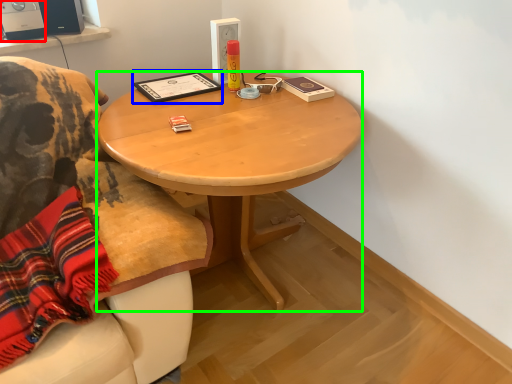
Question: Which object is the farthest from loudspeaker (highlighted by a red box)? Choose among these: book (highlighted by a blue box) or desk (highlighted by a green box).

Choices:
 (A) book
 (B) desk

Answer: (B)